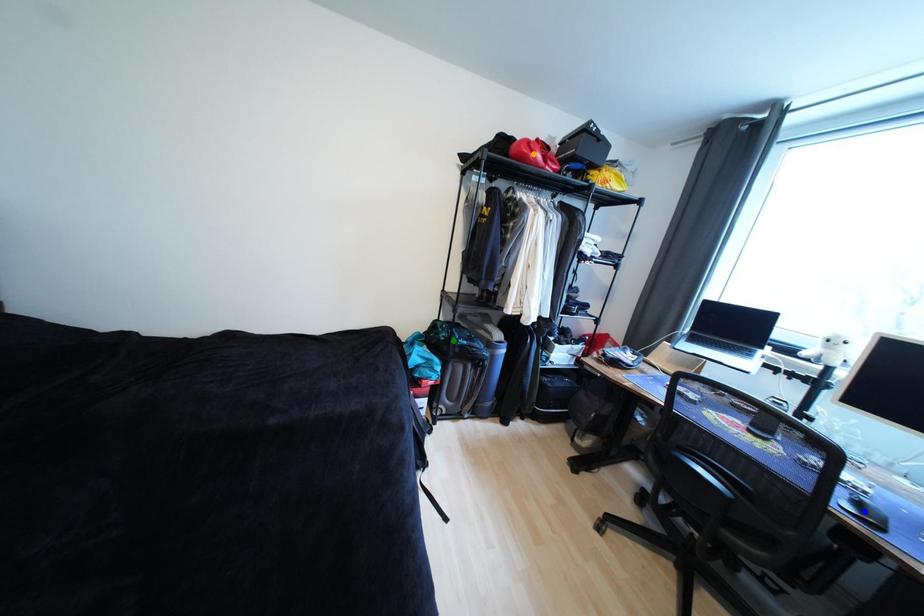
In the scene shown: Order these from nearest to farthest:
- blue point
- orange point
- green point

blue point < orange point < green point